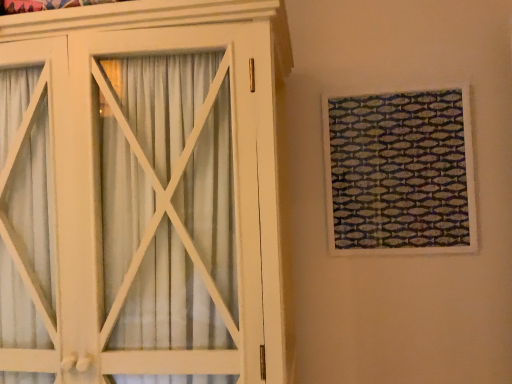
Question: Does textured fabric at upper right have a lesser height compared to white wood cupboard at left?

Choices:
 (A) no
 (B) yes

Answer: (B)

Question: From a real-world perspective, is textured fabric at upper right physically below white wood cupboard at left?

Choices:
 (A) no
 (B) yes

Answer: (A)

Question: Is textured fabric at upper right outside of white wood cupboard at left?

Choices:
 (A) no
 (B) yes

Answer: (B)

Question: Does textured fabric at upper right have a larger size compared to white wood cupboard at left?

Choices:
 (A) yes
 (B) no

Answer: (B)

Question: Is textured fabric at upper right thinner than white wood cupboard at left?

Choices:
 (A) yes
 (B) no

Answer: (A)

Question: From the image's perspective, would you say textured fabric at upper right is positioned over white wood cupboard at left?

Choices:
 (A) yes
 (B) no

Answer: (A)

Question: Considering the relative positions of white wood cupboard at left and textured fabric at upper right in the image provided, is white wood cupboard at left in front of textured fabric at upper right?

Choices:
 (A) yes
 (B) no

Answer: (A)

Question: Can we say white wood cupboard at left lies outside textured fabric at upper right?

Choices:
 (A) no
 (B) yes

Answer: (B)

Question: Considering the relative positions of white wood cupboard at left and textured fabric at upper right in the image provided, is white wood cupboard at left to the left of textured fabric at upper right from the viewer's perspective?

Choices:
 (A) yes
 (B) no

Answer: (A)

Question: Can you confirm if white wood cupboard at left is wider than textured fabric at upper right?

Choices:
 (A) no
 (B) yes

Answer: (B)

Question: Is white wood cupboard at left facing away from textured fabric at upper right?

Choices:
 (A) no
 (B) yes

Answer: (A)

Question: From a real-world perspective, is white wood cupboard at left positioned under textured fabric at upper right based on gravity?

Choices:
 (A) no
 (B) yes

Answer: (B)

Question: Is textured fabric at upper right taller or shorter than white wood cupboard at left?

Choices:
 (A) short
 (B) tall

Answer: (A)